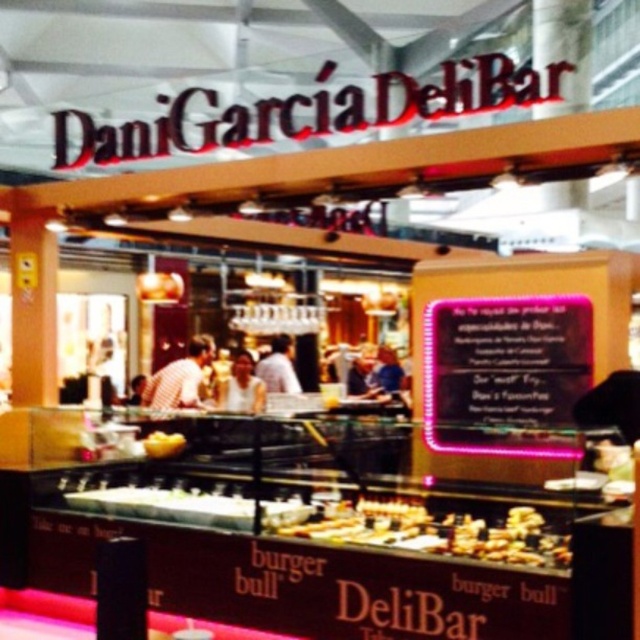
Between checkered fabric shirt at center and smooth white shirt at center, which one appears on the left side from the viewer's perspective?

Positioned to the left is checkered fabric shirt at center.

Is checkered fabric shirt at center in front of smooth white shirt at center?

Yes, checkered fabric shirt at center is closer to the viewer.

Is point (147, 401) positioned before point (384, 362)?

Yes, it is in front of point (384, 362).

This screenshot has height=640, width=640. In order to click on checkered fabric shirt at center in this screenshot , I will do `click(179, 378)`.

Does golden brown bread at center appear under white matte shirt at center?

Yes, golden brown bread at center is below white matte shirt at center.

Locate an element on the screen. The height and width of the screenshot is (640, 640). golden brown bread at center is located at coordinates (436, 532).

This screenshot has height=640, width=640. I want to click on golden brown bread at center, so click(x=436, y=532).

The width and height of the screenshot is (640, 640). Describe the element at coordinates (278, 368) in the screenshot. I see `white shirt at center` at that location.

Who is more forward, (296, 380) or (170, 444)?

Point (170, 444) is more forward.

Image resolution: width=640 pixels, height=640 pixels. What are the coordinates of `white shirt at center` in the screenshot? It's located at (278, 368).